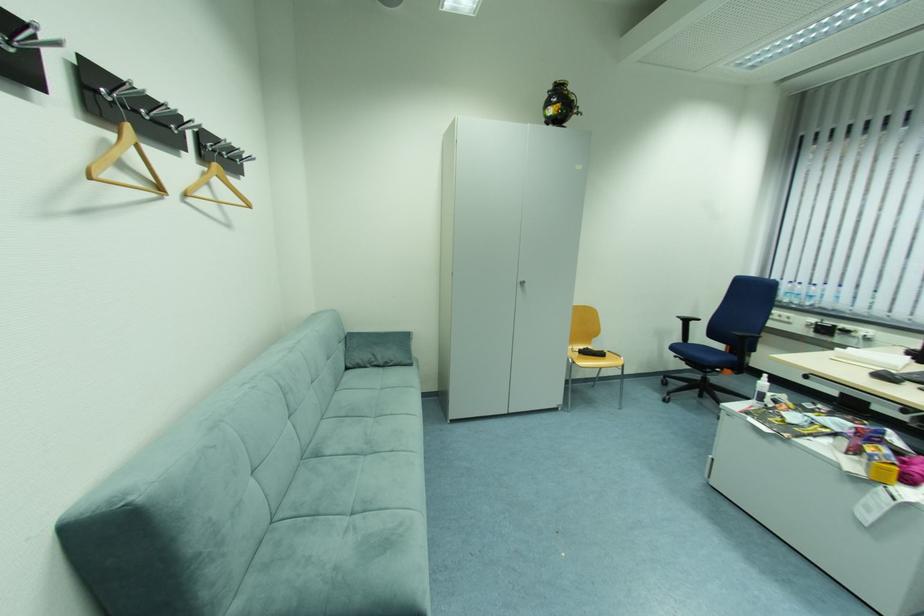
Where is `yellow chair sitting surface`? This screenshot has height=616, width=924. yellow chair sitting surface is located at coordinates (593, 359).